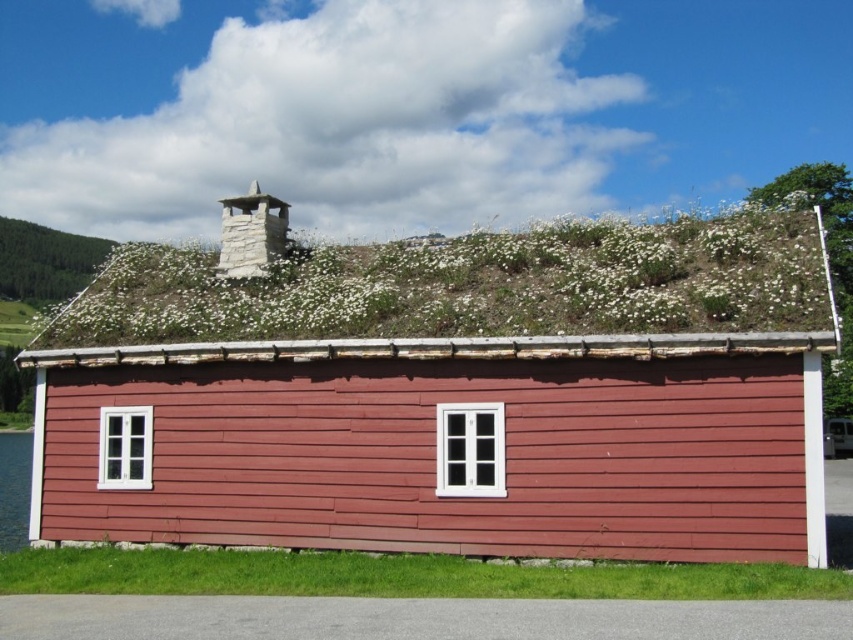
Is the position of white grass at upper center more distant than that of green grass at lower center?

Yes.

Which is below, white grass at upper center or green grass at lower center?

green grass at lower center is lower down.

The height and width of the screenshot is (640, 853). What do you see at coordinates (473, 285) in the screenshot? I see `white grass at upper center` at bounding box center [473, 285].

The width and height of the screenshot is (853, 640). Identify the location of white grass at upper center. (473, 285).

Is matte red wooden hut at center thinner than white grass at upper center?

No, matte red wooden hut at center is not thinner than white grass at upper center.

Can you confirm if matte red wooden hut at center is wider than white grass at upper center?

Yes.

Does point (442, 291) lie behind point (207, 252)?

No, it is not.

The width and height of the screenshot is (853, 640). In order to click on matte red wooden hut at center in this screenshot , I will do `click(448, 394)`.

Who is lower down, matte red wooden hut at center or green grass at lower center?

green grass at lower center

Between matte red wooden hut at center and green grass at lower center, which one appears on the left side from the viewer's perspective?

green grass at lower center is more to the left.

Locate an element on the screen. The image size is (853, 640). matte red wooden hut at center is located at coordinates (448, 394).

Locate an element on the screen. matte red wooden hut at center is located at coordinates (448, 394).